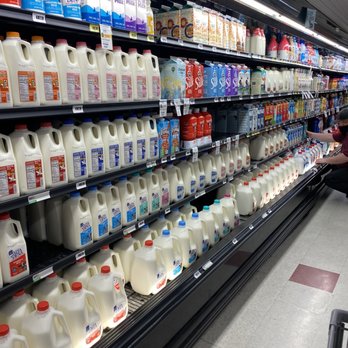
Where is `half gallons of milk with red labels`? The image size is (348, 348). half gallons of milk with red labels is located at coordinates click(19, 263), click(1, 279), click(7, 191), click(28, 178), click(53, 169).